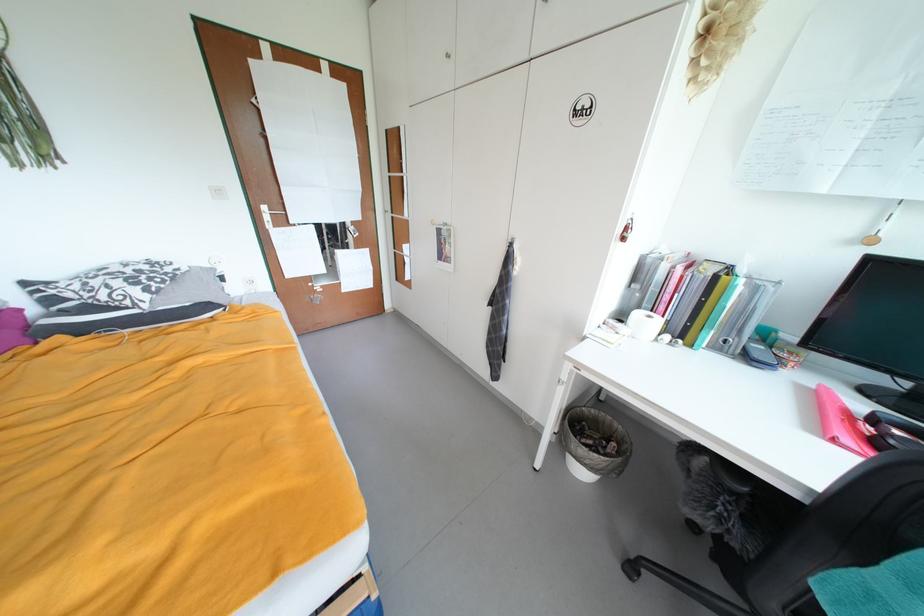
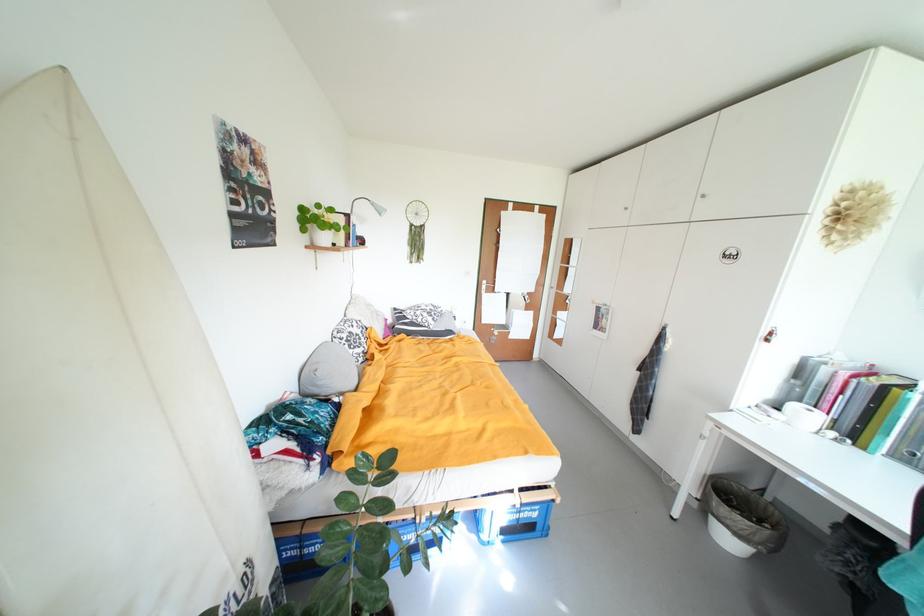
Locate, in the second image, the point that corresponds to [29,312] in the first image.

(394, 322)